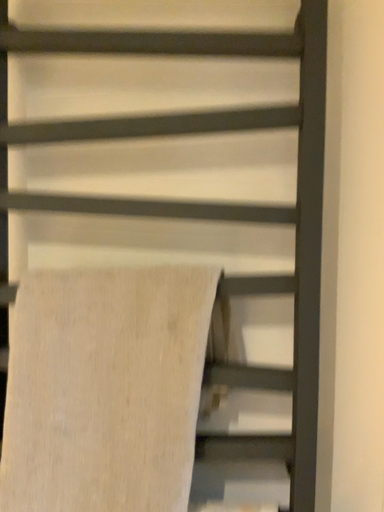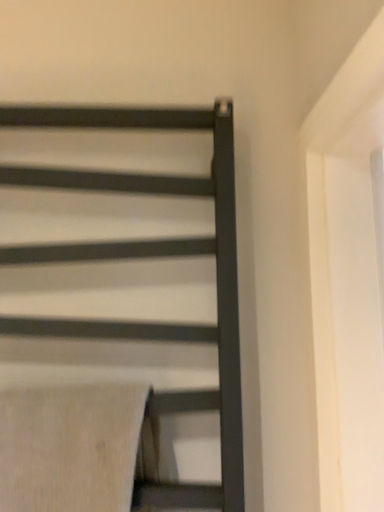
Question: How did the camera likely rotate when shooting the video?

Choices:
 (A) rotated right
 (B) rotated left

Answer: (A)